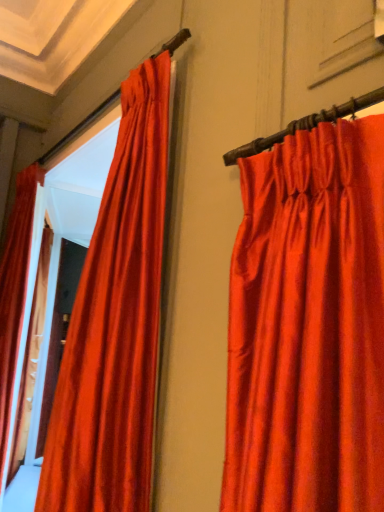
Question: Should I look upward or downward to see satin red curtain at left, marked as the first curtain in a back-to-front arrangement?

Choices:
 (A) down
 (B) up

Answer: (A)

Question: From the image's perspective, is satin red curtain at center, which ranks as the first curtain in front-to-back order, below satin red curtain at left, arranged as the second curtain when viewed from the front?

Choices:
 (A) yes
 (B) no

Answer: (B)

Question: From a real-world perspective, does satin red curtain at center, the first curtain viewed from the right, stand above satin red curtain at left, arranged as the second curtain when viewed from the front?

Choices:
 (A) yes
 (B) no

Answer: (A)

Question: Is satin red curtain at center, which is the second curtain in left-to-right order, surrounding satin red curtain at left, arranged as the second curtain when viewed from the front?

Choices:
 (A) yes
 (B) no

Answer: (B)

Question: Are satin red curtain at center, which ranks as the first curtain in front-to-back order, and satin red curtain at left, marked as the first curtain in a back-to-front arrangement, far apart?

Choices:
 (A) no
 (B) yes

Answer: (B)

Question: Is satin red curtain at center, which ranks as the first curtain in front-to-back order, wider than satin red curtain at left, arranged as the second curtain when viewed from the front?

Choices:
 (A) yes
 (B) no

Answer: (A)

Question: Is satin red curtain at center, which is the second curtain in left-to-right order, to the left of satin red curtain at left, the first curtain positioned from the left, from the viewer's perspective?

Choices:
 (A) no
 (B) yes

Answer: (A)

Question: Can you confirm if satin red curtain at left, acting as the second curtain starting from the right, is smaller than satin red curtain at center, which is the second curtain in left-to-right order?

Choices:
 (A) no
 (B) yes

Answer: (A)

Question: Does satin red curtain at left, arranged as the second curtain when viewed from the front, contain satin red curtain at center, the first curtain viewed from the right?

Choices:
 (A) no
 (B) yes

Answer: (A)

Question: Is satin red curtain at left, arranged as the second curtain when viewed from the front, located outside satin red curtain at center, the first curtain viewed from the right?

Choices:
 (A) no
 (B) yes

Answer: (B)

Question: From the image's perspective, is satin red curtain at left, arranged as the second curtain when viewed from the front, located above satin red curtain at center, positioned as the 2th curtain in back-to-front order?

Choices:
 (A) yes
 (B) no

Answer: (B)

Question: From a real-world perspective, is satin red curtain at left, acting as the second curtain starting from the right, positioned under satin red curtain at center, positioned as the 2th curtain in back-to-front order, based on gravity?

Choices:
 (A) yes
 (B) no

Answer: (A)

Question: Is the position of satin red curtain at left, the first curtain positioned from the left, more distant than that of satin red curtain at center, positioned as the 2th curtain in back-to-front order?

Choices:
 (A) yes
 (B) no

Answer: (A)

Question: Is point (44, 175) positioned closer to the camera than point (144, 141)?

Choices:
 (A) farther
 (B) closer

Answer: (A)